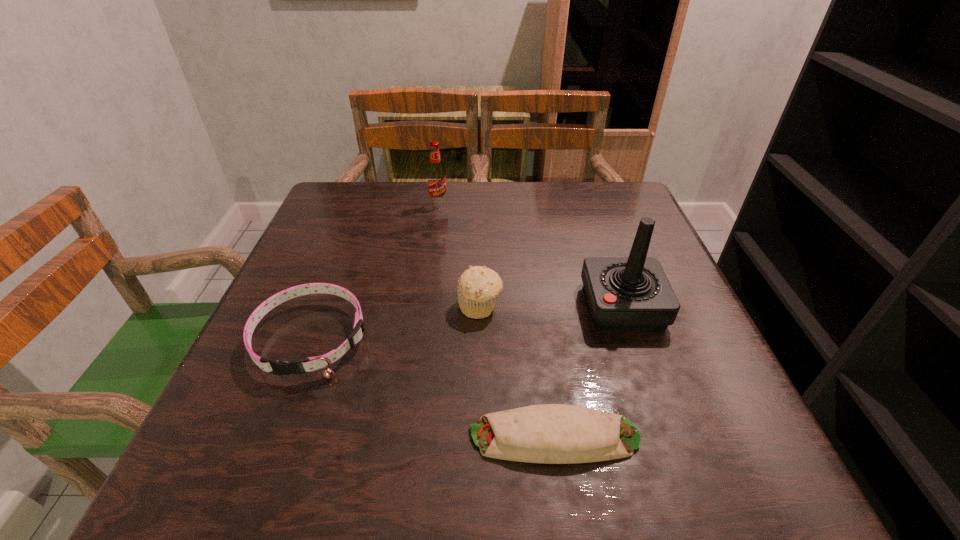
Identify the location of object positioned at the right edge. (632, 293).

This screenshot has width=960, height=540. I want to click on free space at the far edge of the desktop, so click(x=512, y=207).

I want to click on blank space at the near edge, so click(580, 472).

The width and height of the screenshot is (960, 540). I want to click on free spot at the left edge of the desktop, so click(x=262, y=374).

In the image, there is a desktop. At what (x,y) coordinates should I click in order to perform the action: click on vacant space at the right edge. Please return your answer as a coordinate pair (x, y). This screenshot has width=960, height=540. Looking at the image, I should click on (673, 275).

This screenshot has width=960, height=540. In the image, there is a desktop. Identify the location of blank space at the far left corner. (361, 219).

Locate an element on the screen. The height and width of the screenshot is (540, 960). vacant space at the far right corner of the desktop is located at coordinates (588, 194).

Where is `empty space between the dog collar and the third tallest object`? empty space between the dog collar and the third tallest object is located at coordinates (396, 322).

I want to click on unoccupied area between the nearest object and the second object from left to right, so click(x=496, y=320).

Where is `free space between the third shortest object and the nearest object`? Image resolution: width=960 pixels, height=540 pixels. free space between the third shortest object and the nearest object is located at coordinates (517, 372).